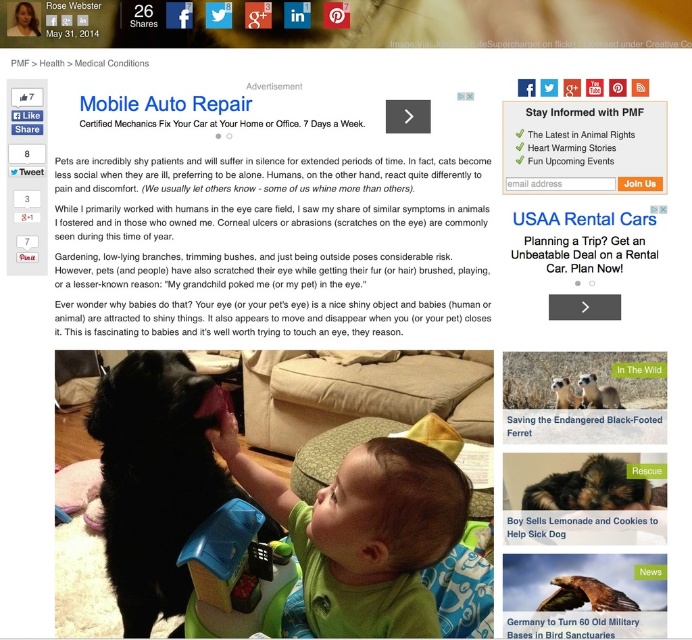
Question: Is green matte baby at center wider than soft brown fur at center?

Choices:
 (A) yes
 (B) no

Answer: (A)

Question: Among these objects, which one is nearest to the camera?

Choices:
 (A) brown matte hair at center
 (B) black fur dog at center

Answer: (A)

Question: Estimate the real-world distances between objects in this image. Which object is farther from the brown feathered eagle at center?

Choices:
 (A) black fur dog at center
 (B) soft brown fur at center
 (C) brown matte hair at center

Answer: (A)

Question: Where is soft brown fur puppy at center located in relation to white paper text at upper center in the image?

Choices:
 (A) above
 (B) below

Answer: (B)

Question: Does black fur dog at center appear on the left side of brown fur meerkat at center?

Choices:
 (A) yes
 (B) no

Answer: (A)

Question: Which object is farther from the camera taking this photo?

Choices:
 (A) soft brown fur at center
 (B) brown feathered eagle at center
 (C) black fur dog at center
 (D) brown matte hair at center

Answer: (C)